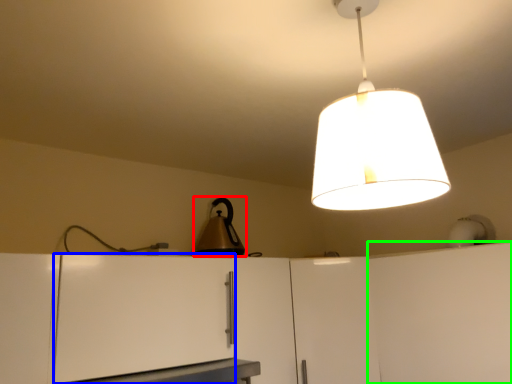
Question: Based on their relative distances, which object is nearer to appliance (highlighted by a red box)? Choose from cabinetry (highlighted by a blue box) and cabinetry (highlighted by a green box).

Choices:
 (A) cabinetry
 (B) cabinetry

Answer: (A)